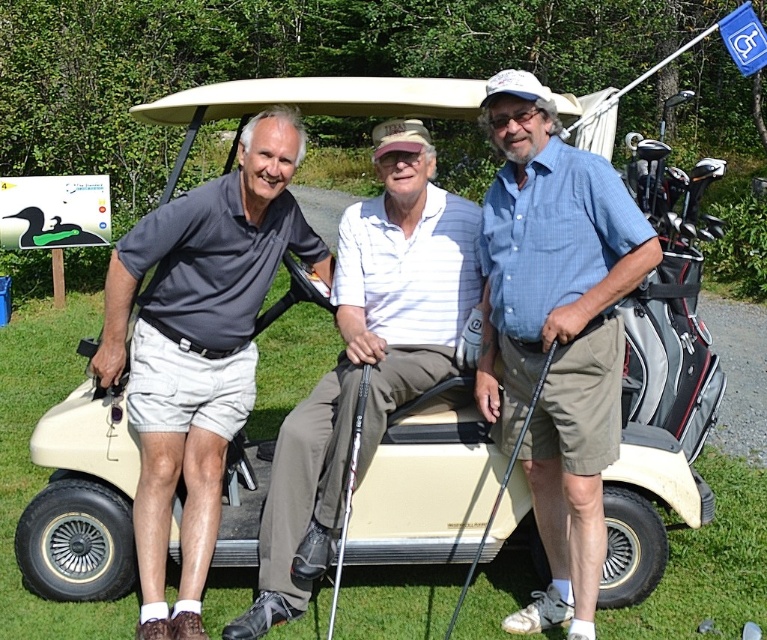
Is blue plaid shirt at center shorter than white striped polo shirt at center?

In fact, blue plaid shirt at center may be taller than white striped polo shirt at center.

Who is shorter, blue plaid shirt at center or white striped polo shirt at center?

white striped polo shirt at center is shorter.

Between point (578, 556) and point (374, 214), which one is positioned behind?

Positioned behind is point (374, 214).

At what (x,y) coordinates should I click in order to perform the action: click on blue plaid shirt at center. Please return your answer as a coordinate pair (x, y). Looking at the image, I should click on (555, 332).

Is silver metallic golf club at center further to camera compared to black metallic golf club at center?

That is False.

Describe the element at coordinates (347, 490) in the screenshot. I see `silver metallic golf club at center` at that location.

The image size is (767, 640). I want to click on silver metallic golf club at center, so click(x=347, y=490).

Is blue plaid shirt at center shorter than black metallic golf club at center?

No.

Is point (594, 346) closer to viewer compared to point (542, 376)?

No, (594, 346) is further to viewer.

The width and height of the screenshot is (767, 640). Describe the element at coordinates (555, 332) in the screenshot. I see `blue plaid shirt at center` at that location.

Where is `blue plaid shirt at center`? Image resolution: width=767 pixels, height=640 pixels. blue plaid shirt at center is located at coordinates (555, 332).